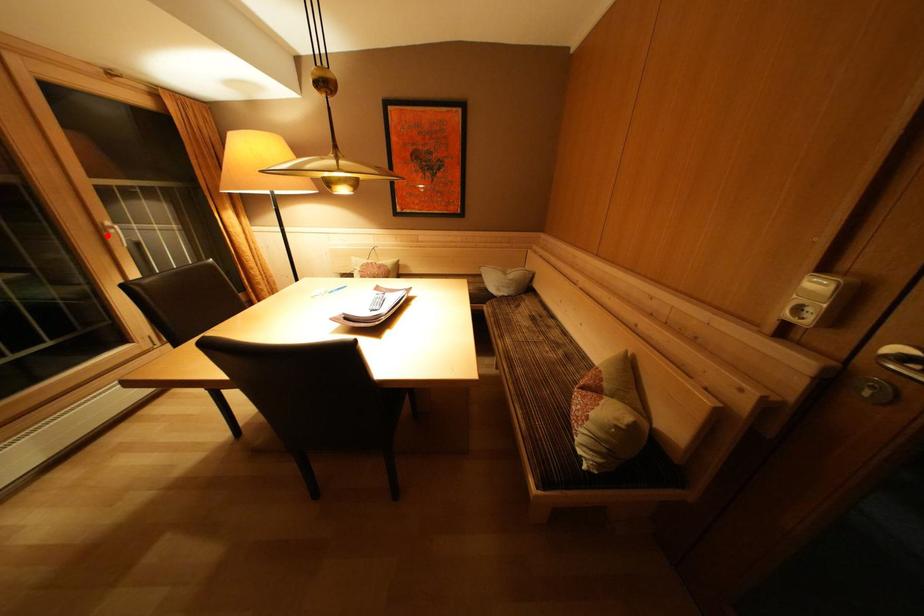
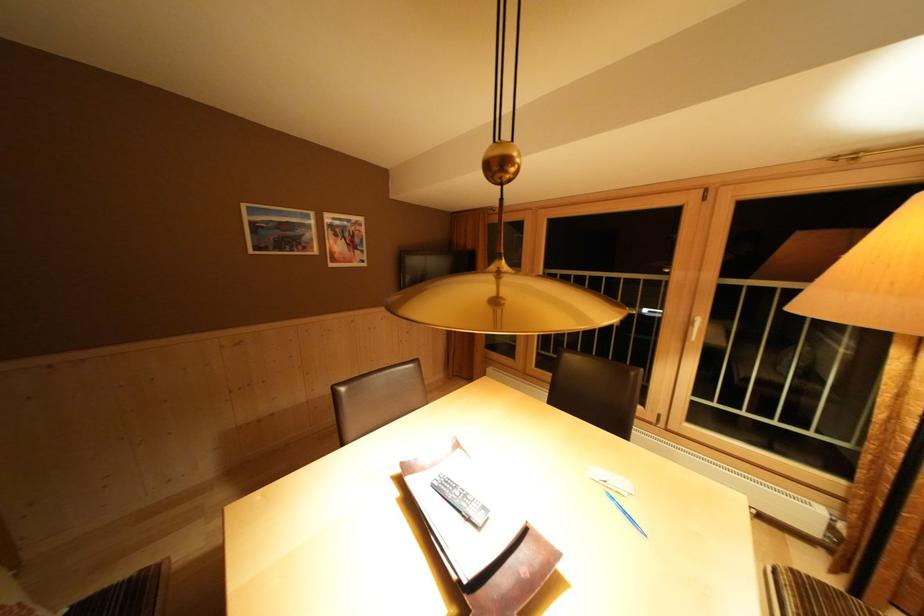
The point at the highlighted location is marked in the first image. Where is the corresponding point in the second image?

(697, 328)